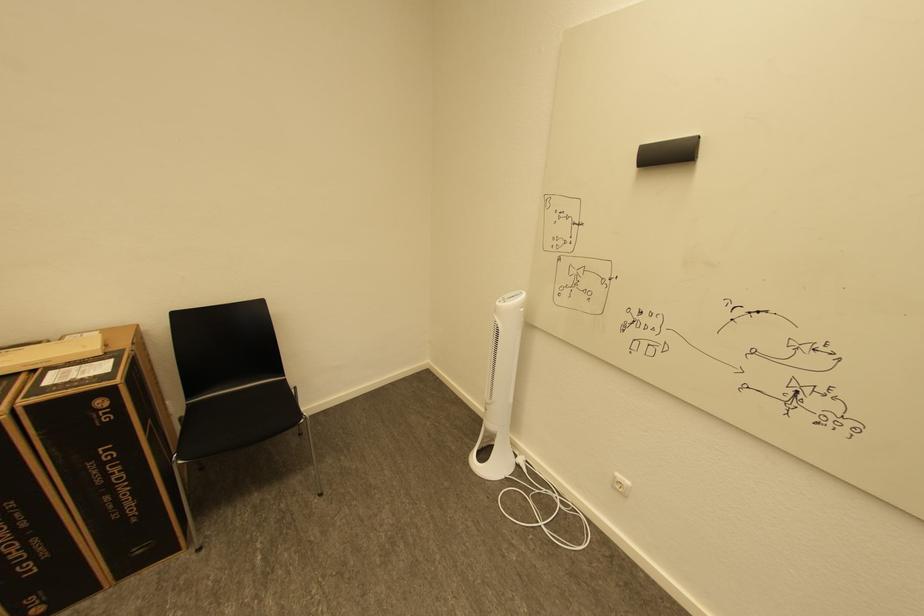
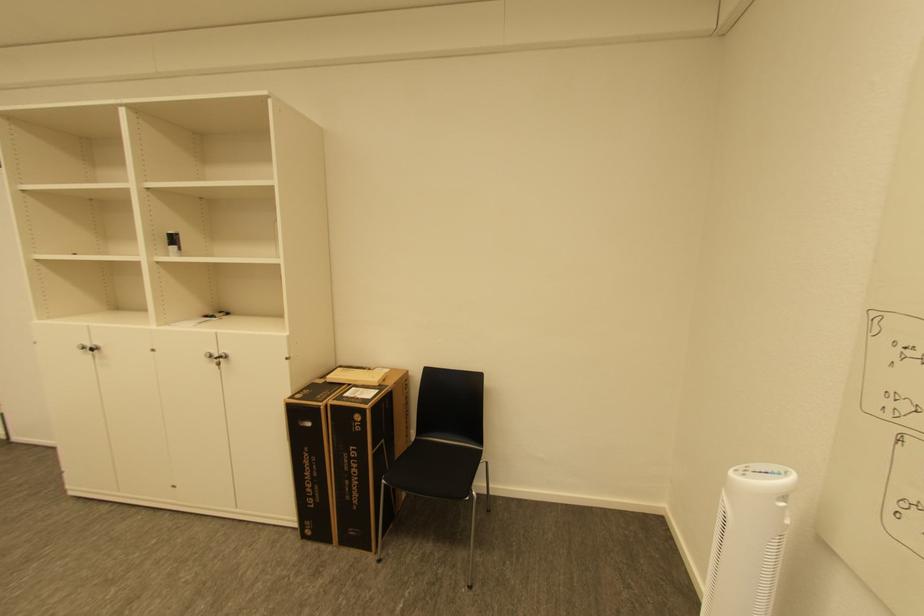
Question: The camera is either moving clockwise (left) or counter-clockwise (right) around the object. The first image is from the beginning of the video and the second image is from the end. Is the camera moving left or right when shooting the video?

Choices:
 (A) Left
 (B) Right

Answer: (B)